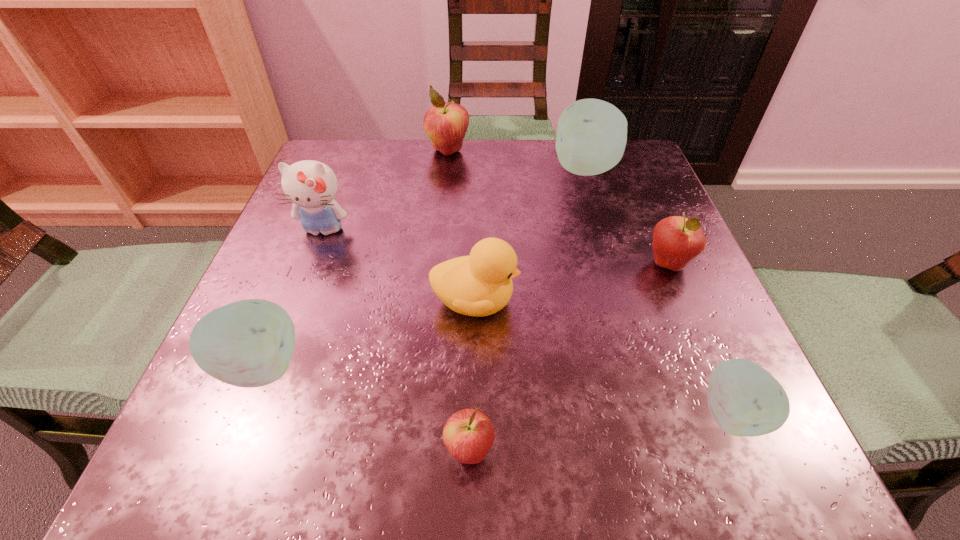
Locate an element on the screen. object that is at the far right corner is located at coordinates (591, 138).

You are a GUI agent. You are given a task and a screenshot of the screen. Output one action in this format:
    pyautogui.click(x=<x>, y=<y>)
    Task: Click on the object that is positioned at the near right corner
    
    Given the screenshot: What is the action you would take?
    pyautogui.click(x=745, y=400)

The height and width of the screenshot is (540, 960). In the image, there is a desktop. In order to click on free space at the far edge in this screenshot , I will do `click(384, 178)`.

Where is `vacant space at the left edge of the desktop`? The height and width of the screenshot is (540, 960). vacant space at the left edge of the desktop is located at coordinates (334, 273).

The width and height of the screenshot is (960, 540). Find the location of `blank space at the right edge of the desktop`. blank space at the right edge of the desktop is located at coordinates (629, 227).

The width and height of the screenshot is (960, 540). Identify the location of free region at the far left corner of the desktop. tap(375, 185).

The height and width of the screenshot is (540, 960). I want to click on free space at the near left corner of the desktop, so click(x=230, y=438).

This screenshot has height=540, width=960. In order to click on vacant space at the far right corner in this screenshot , I will do coord(638,174).

The width and height of the screenshot is (960, 540). In order to click on blank space at the near right corner of the desktop in this screenshot , I will do `click(681, 436)`.

Find the location of a particular element. The height and width of the screenshot is (540, 960). empty location between the rightmost red apple and the duck is located at coordinates (572, 282).